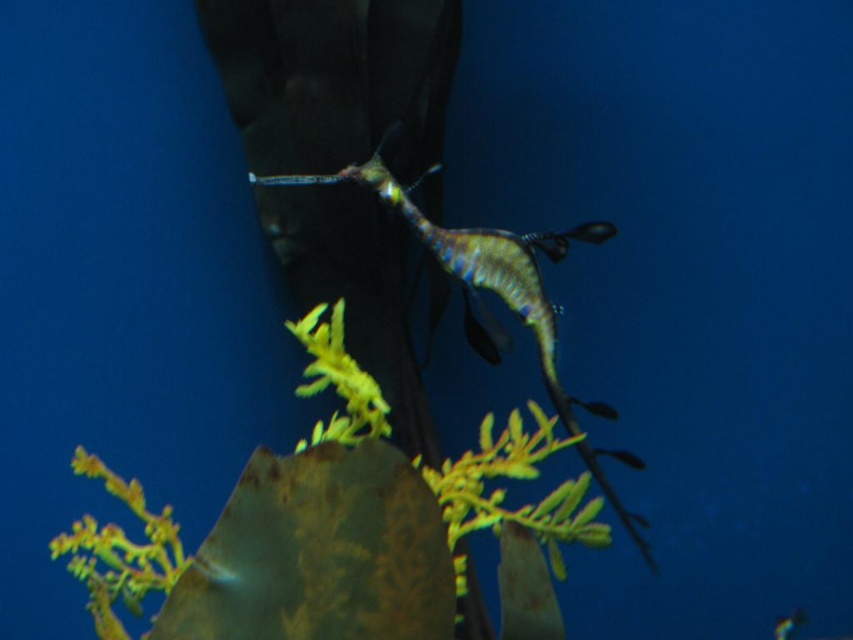
Is green iridescent seahorse at center closer to the viewer compared to shiny silver fish at center?

Yes, green iridescent seahorse at center is closer to the viewer.

Image resolution: width=853 pixels, height=640 pixels. Find the location of `green iridescent seahorse at center`. green iridescent seahorse at center is located at coordinates (474, 259).

This screenshot has height=640, width=853. Find the location of `green iridescent seahorse at center`. green iridescent seahorse at center is located at coordinates (474, 259).

Is green leafy plant at center smaller than green iridescent seahorse at center?

Incorrect, green leafy plant at center is not smaller in size than green iridescent seahorse at center.

Between green leafy plant at center and green iridescent seahorse at center, which one has less height?

With less height is green leafy plant at center.

Who is more distant from viewer, (415, 630) or (563, 244)?

The point (563, 244) is behind.

Where is `green leafy plant at center`? The width and height of the screenshot is (853, 640). green leafy plant at center is located at coordinates (341, 531).

Does green leafy plant at center appear under shiny silver fish at center?

Actually, green leafy plant at center is above shiny silver fish at center.

Between green leafy plant at center and shiny silver fish at center, which one is positioned higher?

green leafy plant at center is higher up.

Measure the distance between point (349,506) and camera.

They are 3.30 feet apart.

You are a GUI agent. You are given a task and a screenshot of the screen. Output one action in this format:
    pyautogui.click(x=<x>, y=<y>)
    Task: Click on the green leafy plant at center
    This screenshot has height=640, width=853.
    Given the screenshot: What is the action you would take?
    pyautogui.click(x=341, y=531)